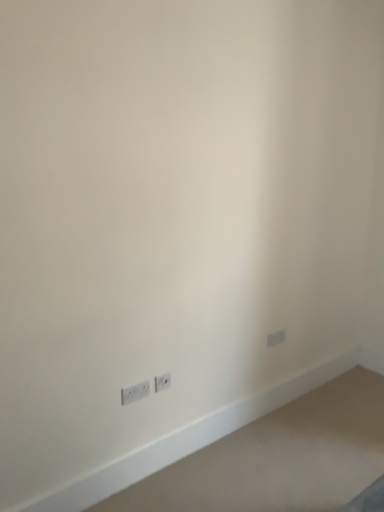
Question: From a real-world perspective, is white plastic power plugs and sockets at lower left, which is the second power plugs and sockets from back to front, physically located above or below white plastic power plugs and sockets at lower left, placed as the 2th power plugs and sockets when sorted from front to back?

Choices:
 (A) below
 (B) above

Answer: (A)

Question: In terms of height, does white plastic power plugs and sockets at lower left, the 1th power plugs and sockets in the left-to-right sequence, look taller or shorter compared to white plastic power plugs and sockets at lower left, placed as the 2th power plugs and sockets when sorted from front to back?

Choices:
 (A) short
 (B) tall

Answer: (A)

Question: Based on their positions, is white plastic power plugs and sockets at lower left, the first power plugs and sockets positioned from the front, located to the left or right of white plastic power plugs and sockets at lower left, acting as the 2th power plugs and sockets starting from the left?

Choices:
 (A) left
 (B) right

Answer: (A)

Question: Do you think white plastic power plugs and sockets at lower left, the first power plugs and sockets when ordered from back to front, is within white plastic power plugs and sockets at lower left, the first power plugs and sockets positioned from the front, or outside of it?

Choices:
 (A) outside
 (B) inside

Answer: (A)

Question: In terms of width, does white plastic power plugs and sockets at lower left, placed as the 2th power plugs and sockets when sorted from front to back, look wider or thinner when compared to white plastic power plugs and sockets at lower left, placed as the second power plugs and sockets when sorted from right to left?

Choices:
 (A) wide
 (B) thin

Answer: (B)

Question: Considering the relative positions of white plastic power plugs and sockets at lower left, acting as the 2th power plugs and sockets starting from the left, and white plastic power plugs and sockets at lower left, the 1th power plugs and sockets in the left-to-right sequence, in the image provided, is white plastic power plugs and sockets at lower left, acting as the 2th power plugs and sockets starting from the left, to the left or to the right of white plastic power plugs and sockets at lower left, the 1th power plugs and sockets in the left-to-right sequence,?

Choices:
 (A) left
 (B) right

Answer: (B)

Question: Does point (167, 386) appear closer or farther from the camera than point (132, 390)?

Choices:
 (A) closer
 (B) farther

Answer: (B)